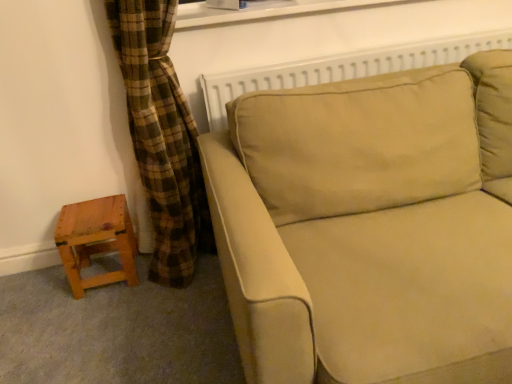
This screenshot has width=512, height=384. What do you see at coordinates (267, 11) in the screenshot?
I see `white plastic window frame at upper center` at bounding box center [267, 11].

This screenshot has width=512, height=384. Find the location of `wooden stool at lower left`. wooden stool at lower left is located at coordinates (96, 241).

Could beige fabric couch at center be considered to be inside wooden stool at lower left?

Definitely not — beige fabric couch at center is not inside wooden stool at lower left.

From a real-world perspective, is wooden stool at lower left located beneath beige fabric couch at center?

Correct, in the physical world, wooden stool at lower left is lower than beige fabric couch at center.

Looking at the image, does wooden stool at lower left seem bigger or smaller compared to beige fabric couch at center?

Clearly, wooden stool at lower left is smaller in size than beige fabric couch at center.

Which of these two, wooden stool at lower left or beige fabric couch at center, stands shorter?

wooden stool at lower left.

Is beige fabric couch at center directly adjacent to white plastic window frame at upper center?

beige fabric couch at center and white plastic window frame at upper center are not in contact.

This screenshot has width=512, height=384. Find the location of `window frame above the beige fabric couch at center (from the image's perspective)`. window frame above the beige fabric couch at center (from the image's perspective) is located at coordinates (267, 11).

Which point is more distant from viewer, (397, 141) or (420, 0)?

The point (420, 0) is farther.

From a real-world perspective, is beige fabric couch at center beneath white plastic window frame at upper center?

Yes, from a real-world perspective, beige fabric couch at center is beneath white plastic window frame at upper center.

Is point (322, 10) closer to camera compared to point (398, 205)?

No, (322, 10) is behind (398, 205).

Can you confirm if white plastic window frame at upper center is taller than beige fabric couch at center?

Incorrect, the height of white plastic window frame at upper center is not larger of that of beige fabric couch at center.

Is white plastic window frame at upper center oriented away from beige fabric couch at center?

No, beige fabric couch at center is not at the back of white plastic window frame at upper center.

Which of these two, white plastic window frame at upper center or beige fabric couch at center, is wider?

beige fabric couch at center is wider.

Is beige fabric couch at center positioned with its back to wooden stool at lower left?

beige fabric couch at center does not have its back to wooden stool at lower left.

Who is smaller, beige fabric couch at center or wooden stool at lower left?

With smaller size is wooden stool at lower left.

From the image's perspective, is beige fabric couch at center positioned above or below wooden stool at lower left?

beige fabric couch at center is situated higher than wooden stool at lower left in the image.

From a real-world perspective, who is located lower, beige fabric couch at center or wooden stool at lower left?

wooden stool at lower left.

Is wooden stool at lower left bigger than white plastic window frame at upper center?

No.

Consider the image. Which object is further away from the camera, wooden stool at lower left or white plastic window frame at upper center?

wooden stool at lower left is more distant.

Which is behind, point (89, 211) or point (272, 4)?

The point (272, 4) is farther.

Is white plastic window frame at upper center not close to wooden stool at lower left?

No, white plastic window frame at upper center is not far away from wooden stool at lower left.

Can you confirm if white plastic window frame at upper center is smaller than wooden stool at lower left?

No.

Is white plastic window frame at upper center oriented towards wooden stool at lower left?

No, white plastic window frame at upper center is not oriented towards wooden stool at lower left.

Does point (328, 2) lie behind point (78, 256)?

That is False.

I want to click on studio couch above the wooden stool at lower left (from a real-world perspective), so click(x=370, y=226).

Find the location of a particular element. The width and height of the screenshot is (512, 384). studio couch below the white plastic window frame at upper center (from a real-world perspective) is located at coordinates tap(370, 226).

Estimate the real-world distances between objects in this image. Which object is closer to white plastic window frame at upper center, beige fabric couch at center or wooden stool at lower left?

beige fabric couch at center is closer to white plastic window frame at upper center.

Estimate the real-world distances between objects in this image. Which object is further from beige fabric couch at center, wooden stool at lower left or white plastic window frame at upper center?

wooden stool at lower left lies further to beige fabric couch at center than the other object.

Which object lies further to the anchor point wooden stool at lower left, white plastic window frame at upper center or beige fabric couch at center?

white plastic window frame at upper center is further to wooden stool at lower left.

Considering their positions, is wooden stool at lower left positioned further to white plastic window frame at upper center than beige fabric couch at center?

wooden stool at lower left lies further to white plastic window frame at upper center than the other object.

When comparing their distances from wooden stool at lower left, does beige fabric couch at center or white plastic window frame at upper center seem further?

Based on the image, white plastic window frame at upper center appears to be further to wooden stool at lower left.

Considering their positions, is white plastic window frame at upper center positioned closer to beige fabric couch at center than wooden stool at lower left?

Among the two, white plastic window frame at upper center is located nearer to beige fabric couch at center.

Locate an element on the screen. Image resolution: width=512 pixels, height=384 pixels. window frame between wooden stool at lower left and beige fabric couch at center from left to right is located at coordinates 267,11.